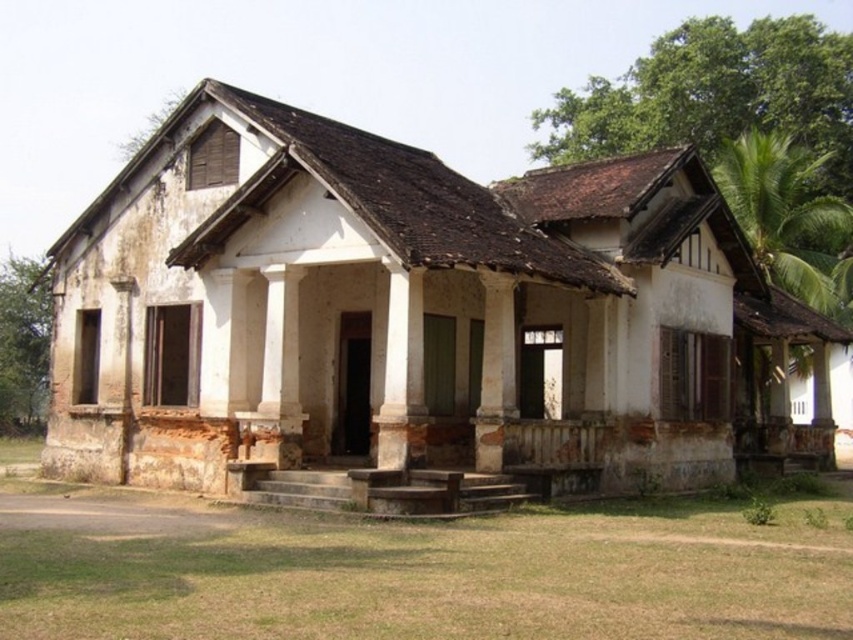
Question: From the image, what is the correct spatial relationship of white smooth pillar at center in relation to brown weathered wood column at center?

Choices:
 (A) above
 (B) below

Answer: (A)

Question: Is white smooth pillar at center thinner than brown weathered wood column at center?

Choices:
 (A) no
 (B) yes

Answer: (A)

Question: Which object appears closest to the camera in this image?

Choices:
 (A) brown weathered wood column at center
 (B) white smooth pillar at center

Answer: (B)

Question: Is white smooth pillar at center below brown weathered wood column at center?

Choices:
 (A) yes
 (B) no

Answer: (B)

Question: Which object is closer to the camera taking this photo?

Choices:
 (A) brown weathered wood column at center
 (B) white smooth pillar at center

Answer: (B)